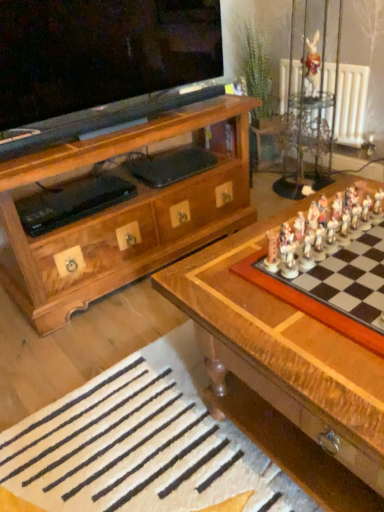
The height and width of the screenshot is (512, 384). I want to click on vacant region above wooden chessboard at center (from a real-world perspective), so click(x=309, y=283).